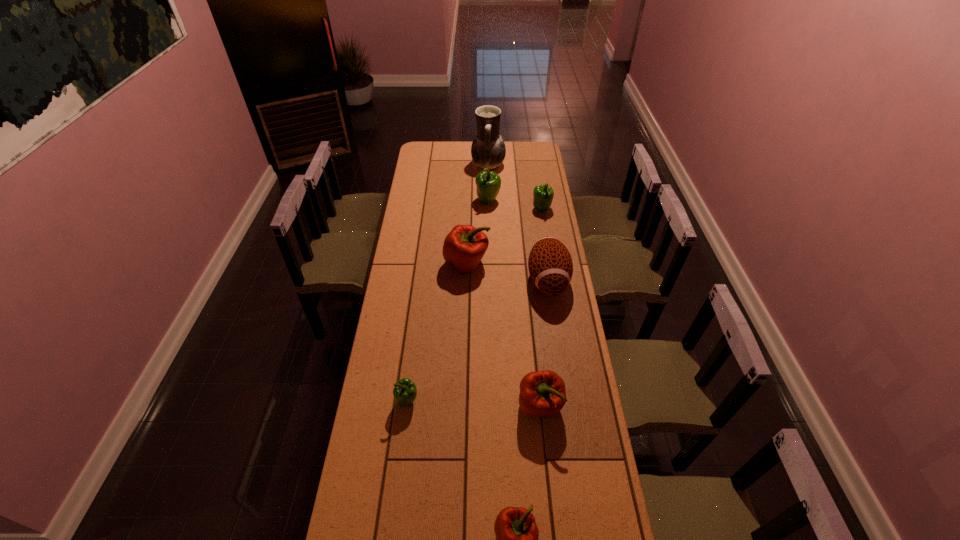
Identify the location of object located in the left edge section of the desktop. (405, 392).

The height and width of the screenshot is (540, 960). Find the location of `football present at the right edge`. football present at the right edge is located at coordinates (550, 265).

The image size is (960, 540). Identify the location of vacant space at the far edge. (453, 154).

Locate an element on the screen. The width and height of the screenshot is (960, 540). free space at the left edge is located at coordinates (396, 430).

Image resolution: width=960 pixels, height=540 pixels. In order to click on vacant region at the right edge of the desktop in this screenshot , I will do `click(567, 457)`.

The height and width of the screenshot is (540, 960). In the image, there is a desktop. In order to click on vacant space at the far left corner in this screenshot , I will do `click(426, 145)`.

I want to click on free space at the far right corner of the desktop, so click(x=530, y=151).

Where is `empty location between the football and the leftmost object`? This screenshot has height=540, width=960. empty location between the football and the leftmost object is located at coordinates (478, 341).

This screenshot has width=960, height=540. Identify the location of empty space between the second smallest green bell pepper and the nearest green bell pepper. point(474,305).

Locate an element on the screen. free spot between the pitcher and the football is located at coordinates (518, 223).